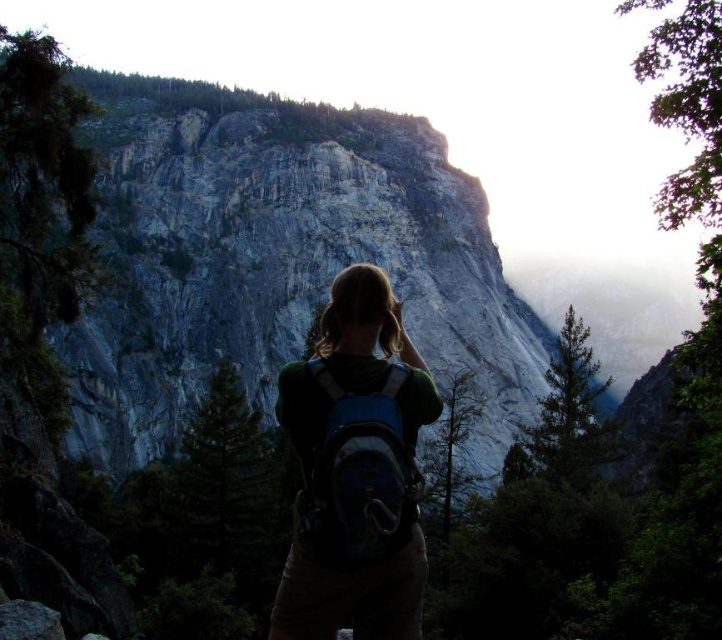
What do you see at coordinates (355, 472) in the screenshot? I see `green fabric backpack at center` at bounding box center [355, 472].

Who is positioned more to the left, green fabric backpack at center or blue fabric backpack at center?

From the viewer's perspective, blue fabric backpack at center appears more on the left side.

Where is `green fabric backpack at center`? green fabric backpack at center is located at coordinates (355, 472).

Locate an element on the screen. The height and width of the screenshot is (640, 722). green fabric backpack at center is located at coordinates (355, 472).